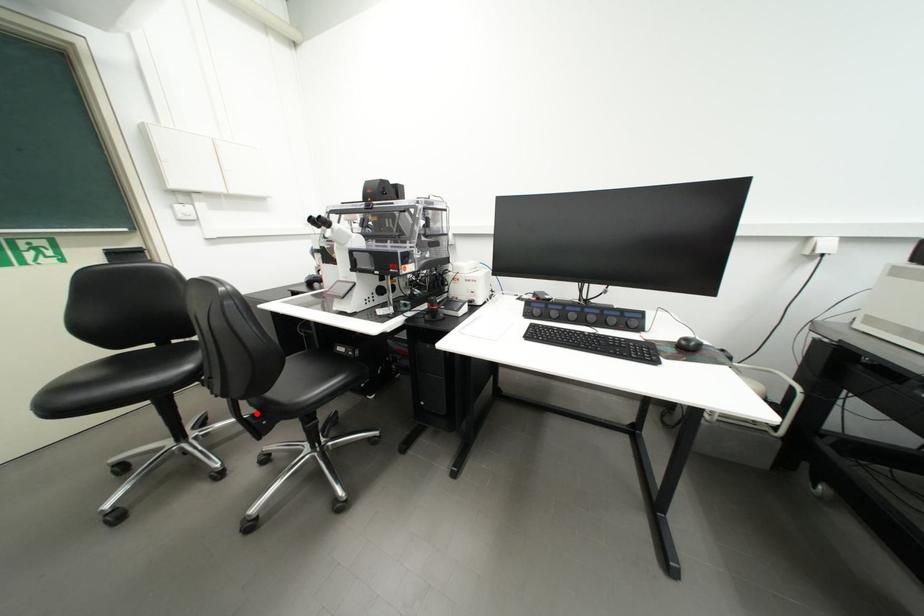
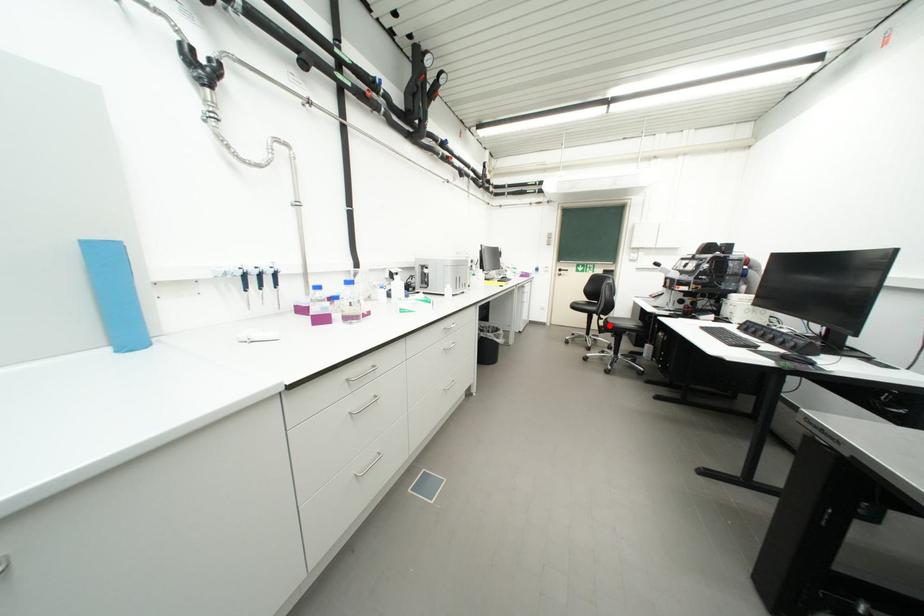
I am providing you with two images of the same scene from different viewpoints. A red point is marked on the first image and another point is marked on the second image. Do the highlighted points in image1 and image2 indicate the same real-world spot?

Yes